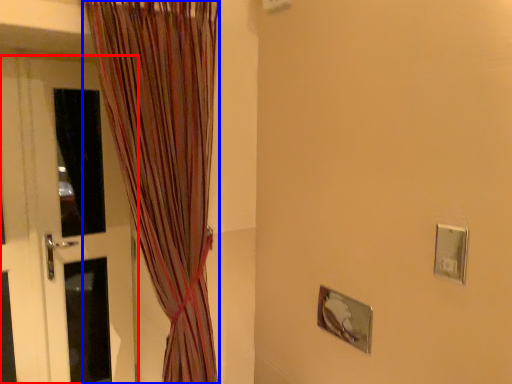
Question: Which object is closer to the camera taking this photo, door (highlighted by a red box) or curtain (highlighted by a blue box)?

Choices:
 (A) door
 (B) curtain

Answer: (B)